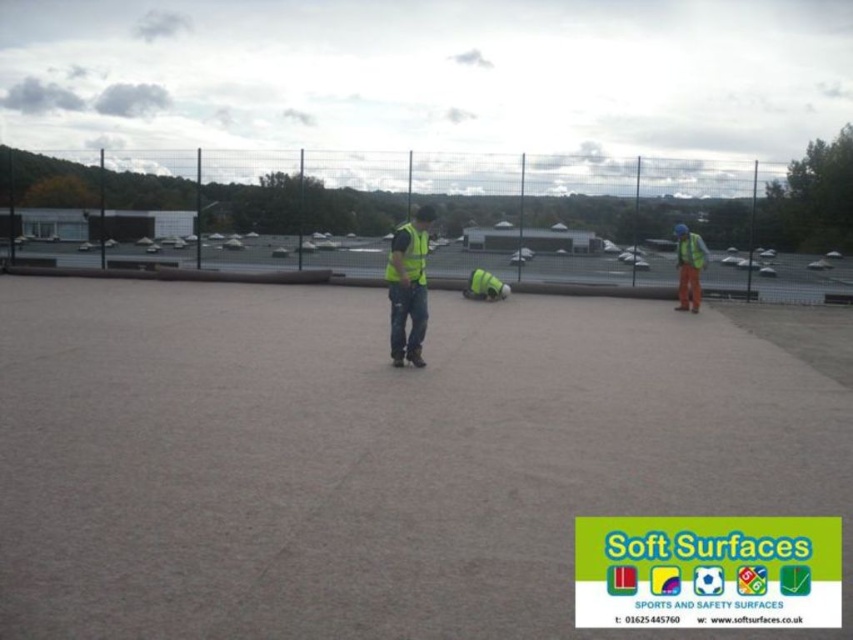
In the scene shown: You are a safety inspector evaluating the layout of the gray concrete parking lot at center and the high visibility vest at center. Based on their sizes, which one do you think occupies more space in the image?

The gray concrete parking lot at center has a larger width than the high visibility vest at center, so it occupies more space in the image.